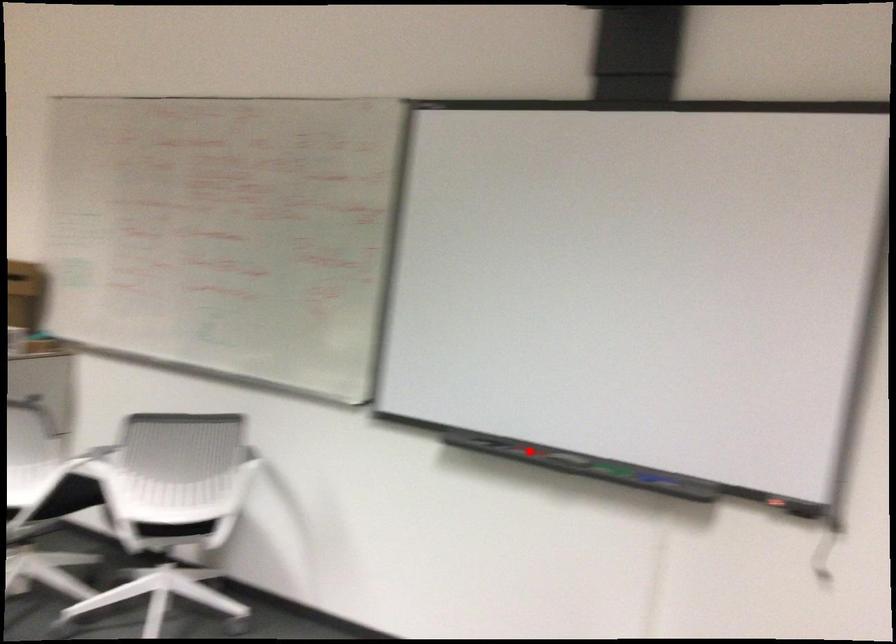
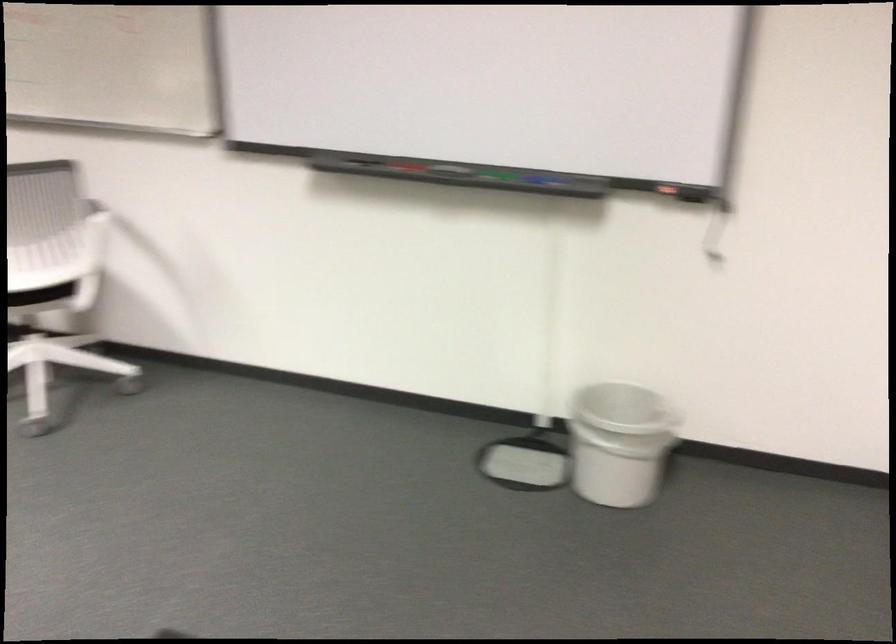
The point at the highlighted location is marked in the first image. Where is the corresponding point in the second image?

(407, 167)